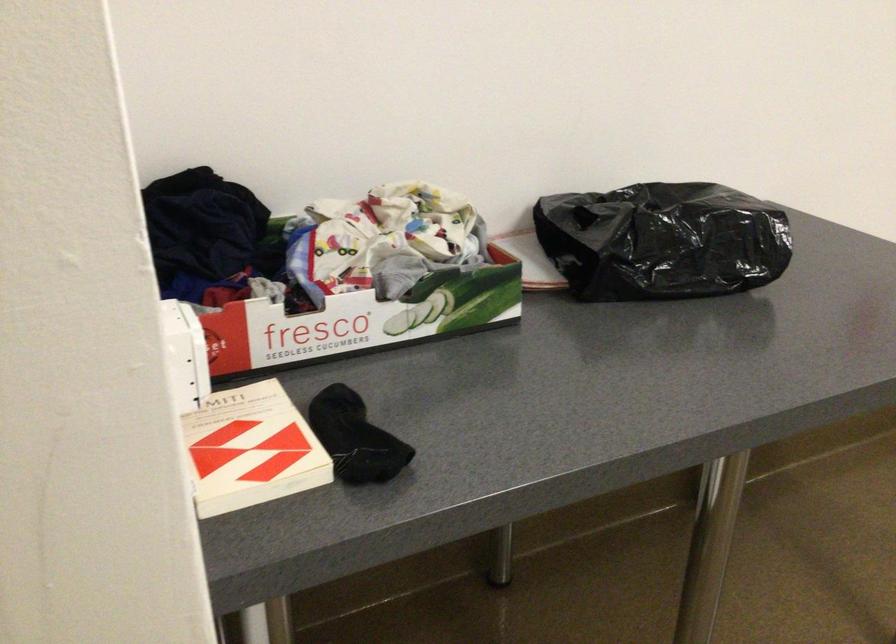
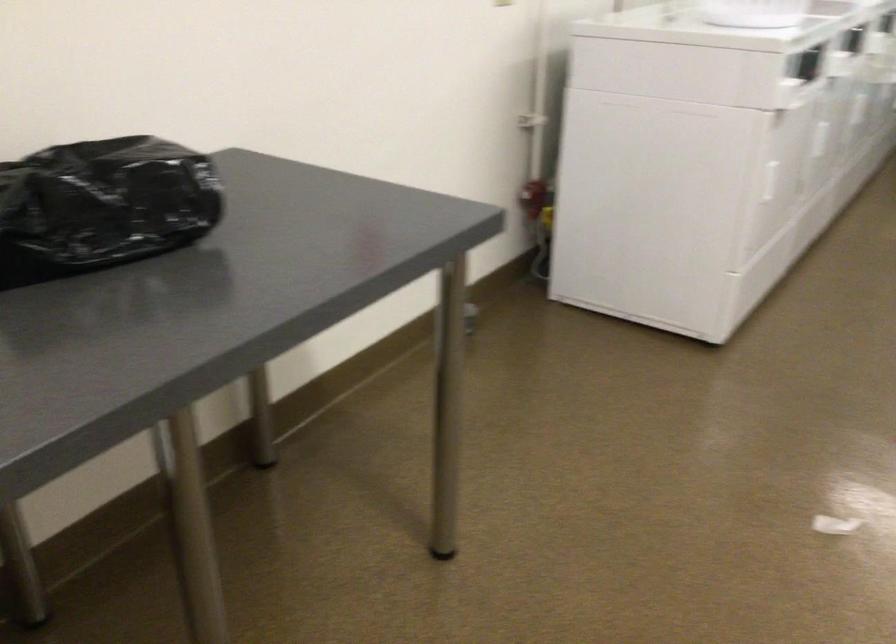
Question: The first image is from the beginning of the video and the second image is from the end. How did the camera likely rotate when shooting the video?

Choices:
 (A) Left
 (B) Right
 (C) Up
 (D) Down

Answer: (B)